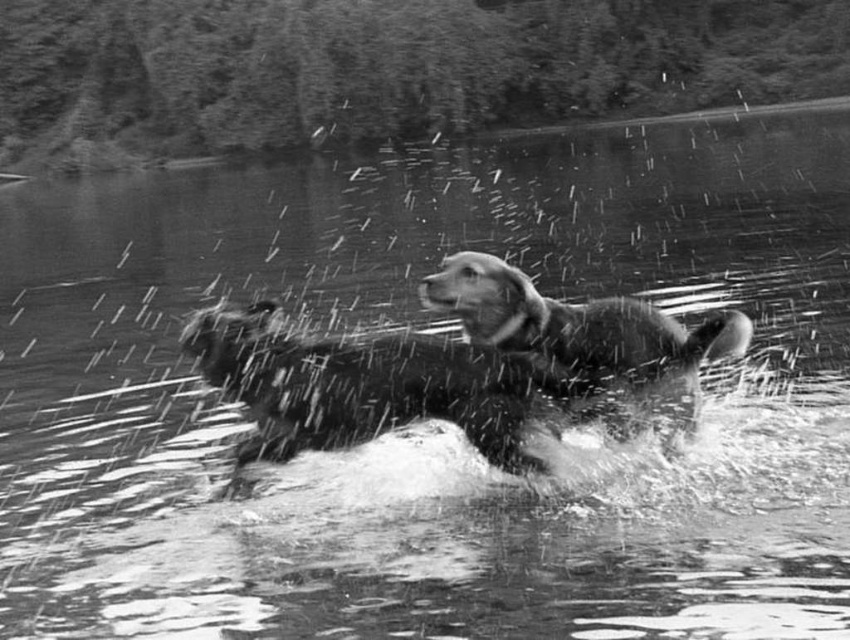
You are a photographer trying to capture the perfect shot of the dog in the water. You notice two dogs in the scene, the fluffy wet dog at center and the soft fur dog at center. Which dog is closer to the water surface?

The fluffy wet dog at center is positioned under soft fur dog at center, meaning the fluffy wet dog at center is closer to the water surface.

You are a photographer trying to capture the perfect shot of the dog in the water. You notice two dogs in the scene, the fluffy wet dog at center and the soft fur dog at center. Which dog is closer to you?

The fluffy wet dog at center is closer to you since it is only 35.70 inches away from the soft fur dog at center, implying the soft fur dog at center is further back.